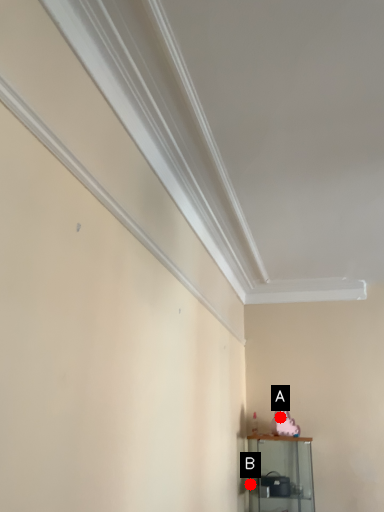
Question: Two points are circled on the image, labeled by A and B beside each circle. Which point is farther to the camera?

Choices:
 (A) A is further
 (B) B is further

Answer: (A)